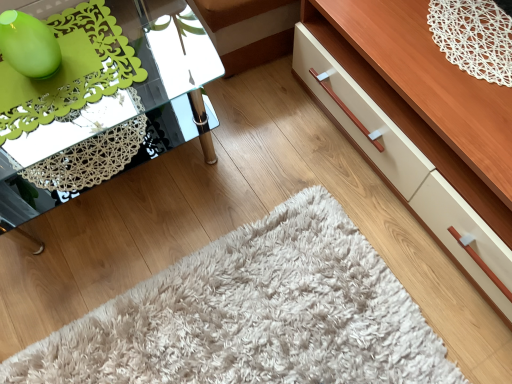
The image size is (512, 384). What do you see at coordinates (102, 100) in the screenshot? I see `clear glass table at left` at bounding box center [102, 100].

Find the location of a particular element. clear glass table at left is located at coordinates (102, 100).

Consider the image. What is the approximate height of clear glass table at left?

clear glass table at left is 17.95 inches in height.

What do you see at coordinates (407, 154) in the screenshot? Image resolution: width=512 pixels, height=384 pixels. I see `wooden dresser at lower right` at bounding box center [407, 154].

Identify the location of wooden dresser at lower right. (407, 154).

I want to click on clear glass table at left, so click(x=102, y=100).

Which is more to the right, wooden dresser at lower right or clear glass table at left?

wooden dresser at lower right is more to the right.

Which is in front, wooden dresser at lower right or clear glass table at left?

Positioned in front is wooden dresser at lower right.

Which is in front, point (418, 151) or point (106, 73)?

Positioned in front is point (106, 73).

From the image's perspective, is wooden dresser at lower right located above or below clear glass table at left?

Clearly, from the image's perspective, wooden dresser at lower right is above clear glass table at left.

From a real-world perspective, which object stands above the other?

In real-world perspective, clear glass table at left is above.

Is wooden dresser at lower right thinner than clear glass table at left?

In fact, wooden dresser at lower right might be wider than clear glass table at left.

In terms of height, does wooden dresser at lower right look taller or shorter compared to clear glass table at left?

In the image, wooden dresser at lower right appears to be shorter than clear glass table at left.

Does wooden dresser at lower right have a larger size compared to clear glass table at left?

Correct, wooden dresser at lower right is larger in size than clear glass table at left.

Is wooden dresser at lower right spatially inside clear glass table at left, or outside of it?

wooden dresser at lower right cannot be found inside clear glass table at left.

Is wooden dresser at lower right placed right next to clear glass table at left?

No, wooden dresser at lower right is not with clear glass table at left.

Is clear glass table at left at the back of wooden dresser at lower right?

wooden dresser at lower right does not have its back to clear glass table at left.

How many degrees apart are the facing directions of wooden dresser at lower right and clear glass table at left?

There is a 89.2-degree angle between the facing directions of wooden dresser at lower right and clear glass table at left.

In order to click on table lying below the wooden dresser at lower right (from the image's perspective) in this screenshot , I will do `click(102, 100)`.

Considering the positions of objects clear glass table at left and wooden dresser at lower right in the image provided, who is more to the right, clear glass table at left or wooden dresser at lower right?

wooden dresser at lower right is more to the right.

Which object is further away from the camera, clear glass table at left or wooden dresser at lower right?

clear glass table at left is further from the camera.

Does point (56, 124) come behind point (343, 69)?

No, it is in front of (343, 69).

From the image's perspective, is clear glass table at left positioned above or below wooden dresser at lower right?

Based on their image positions, clear glass table at left is located beneath wooden dresser at lower right.

From a real-world perspective, which is physically above, clear glass table at left or wooden dresser at lower right?

clear glass table at left is physically above.

Can you confirm if clear glass table at left is wider than wooden dresser at lower right?

Incorrect, the width of clear glass table at left does not surpass that of wooden dresser at lower right.

Does clear glass table at left have a greater height compared to wooden dresser at lower right?

Indeed, clear glass table at left has a greater height compared to wooden dresser at lower right.

Considering the sizes of objects clear glass table at left and wooden dresser at lower right in the image provided, who is bigger, clear glass table at left or wooden dresser at lower right?

wooden dresser at lower right.

Is clear glass table at left completely or partially outside of wooden dresser at lower right?

That's correct, clear glass table at left is outside of wooden dresser at lower right.

Is clear glass table at left far away from wooden dresser at lower right?

No.

Is clear glass table at left aimed at wooden dresser at lower right?

No, clear glass table at left is not facing towards wooden dresser at lower right.

Find the location of a particular element. table that is above the wooden dresser at lower right (from a real-world perspective) is located at coordinates (102, 100).

I want to click on table above the wooden dresser at lower right (from a real-world perspective), so click(102, 100).

Locate an element on the screen. Image resolution: width=512 pixels, height=384 pixels. table below the wooden dresser at lower right (from the image's perspective) is located at coordinates (102, 100).